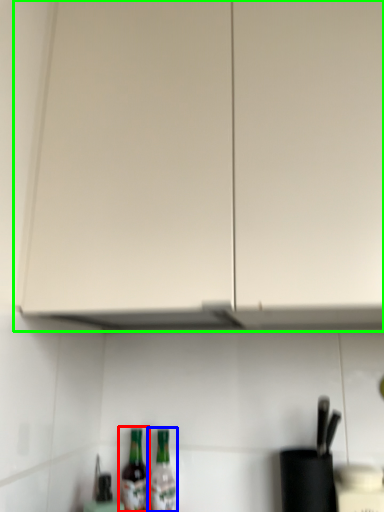
Question: Which object is the farthest from bottle (highlighted by a red box)? Choose among these: bottle (highlighted by a blue box) or cabinetry (highlighted by a green box).

Choices:
 (A) bottle
 (B) cabinetry

Answer: (B)